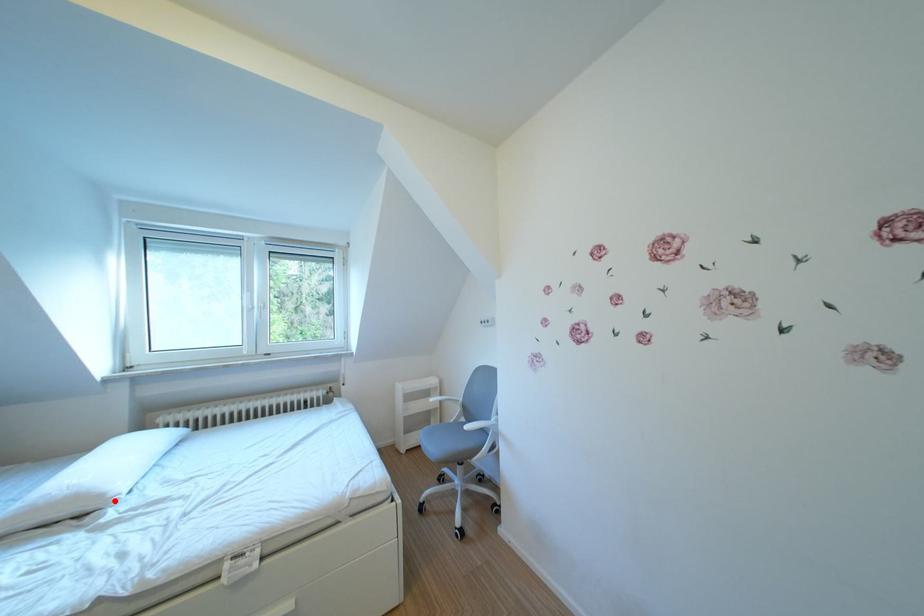
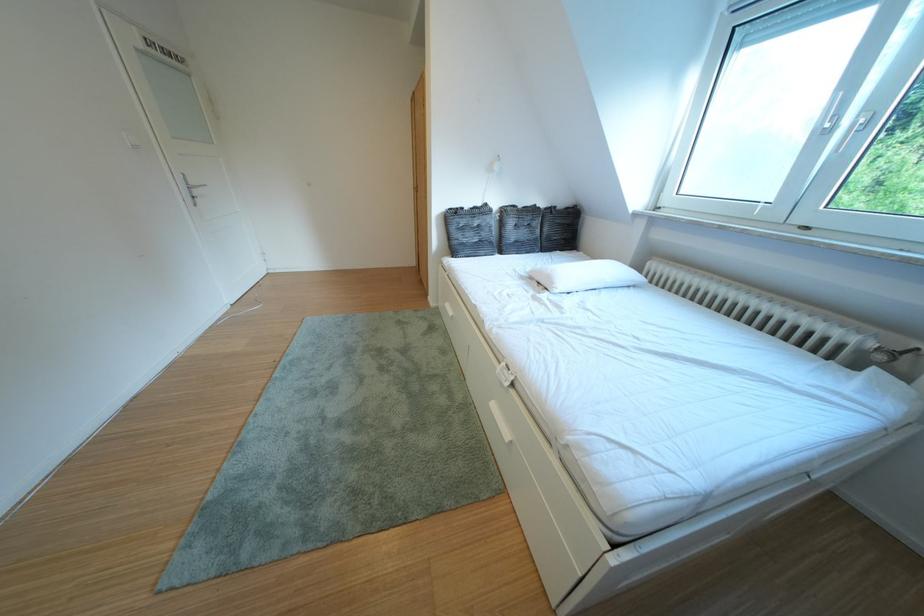
Locate, in the second image, the point that corresponds to the highlighted location in the first image.

(565, 288)